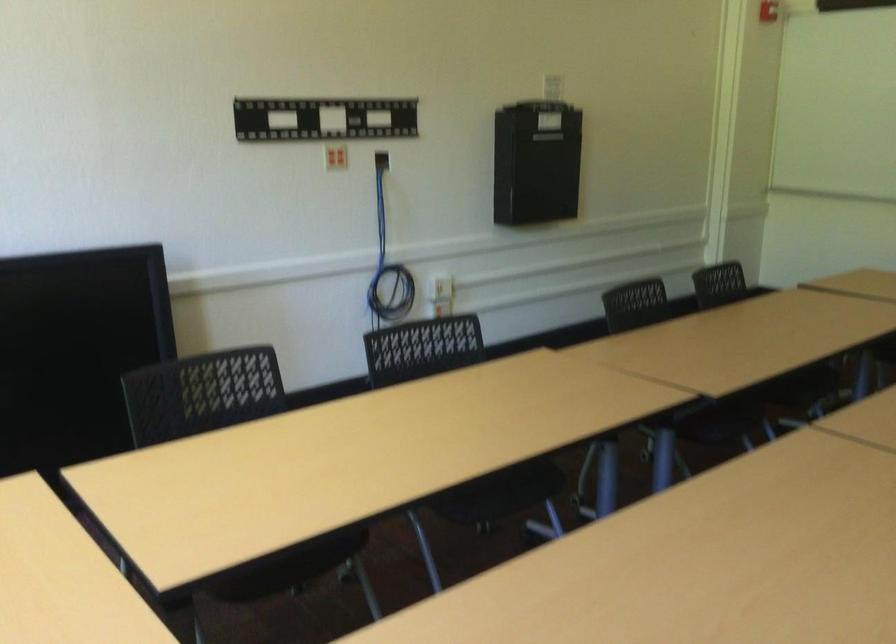
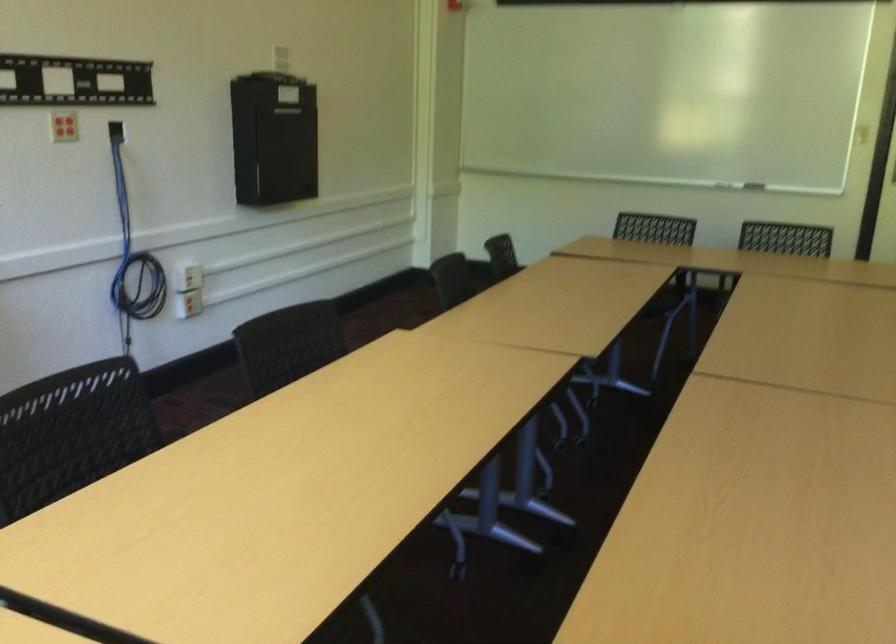
Question: The images are taken continuously from a first-person perspective. In which direction is your viewpoint rotating?

Choices:
 (A) Left
 (B) Right
 (C) Up
 (D) Down

Answer: (B)